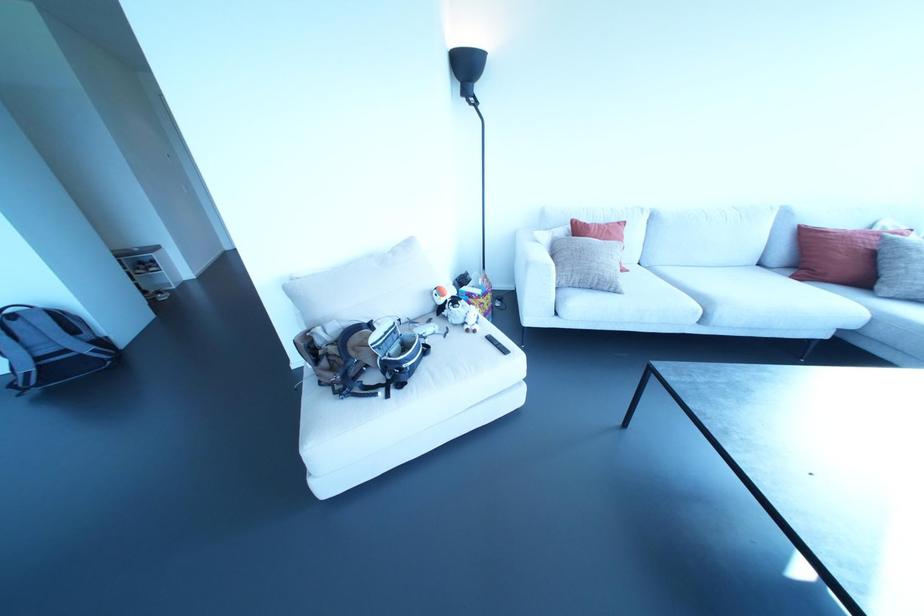
Identify the location of colorful basket. The width and height of the screenshot is (924, 616). (476, 294).